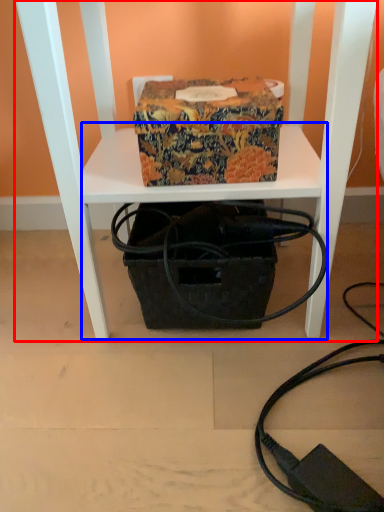
Question: Among these objects, which one is farthest to the camera, furniture (highlighted by a red box) or table (highlighted by a blue box)?

Choices:
 (A) furniture
 (B) table

Answer: (B)